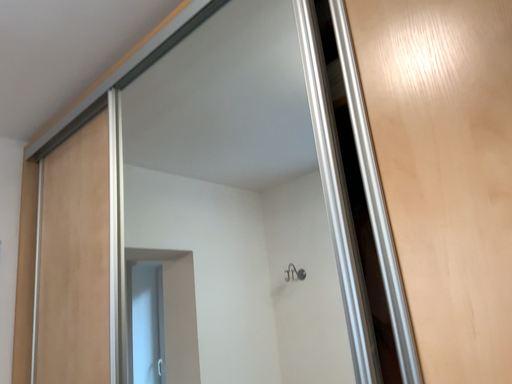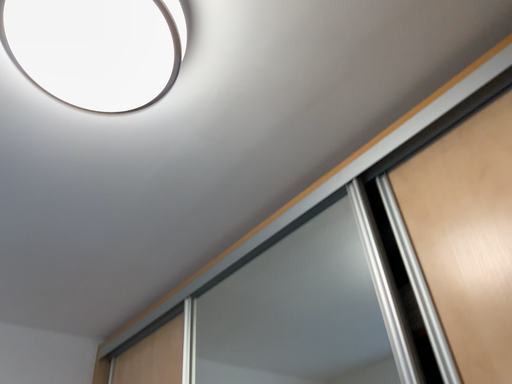
Question: How did the camera likely rotate when shooting the video?

Choices:
 (A) rotated right
 (B) rotated left

Answer: (B)